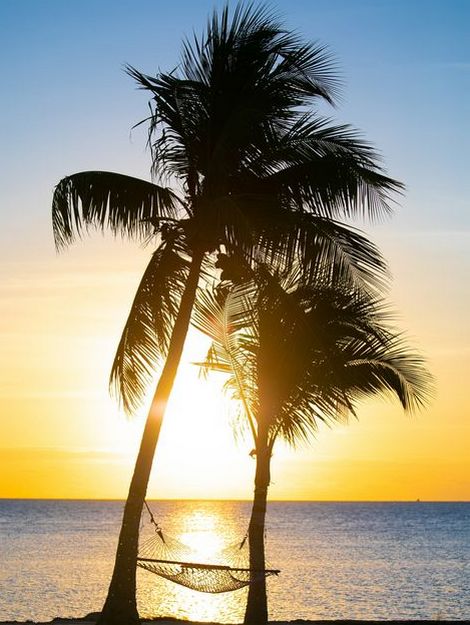
The image size is (470, 625). In order to click on net body of hammock in this screenshot , I will do `click(176, 571)`.